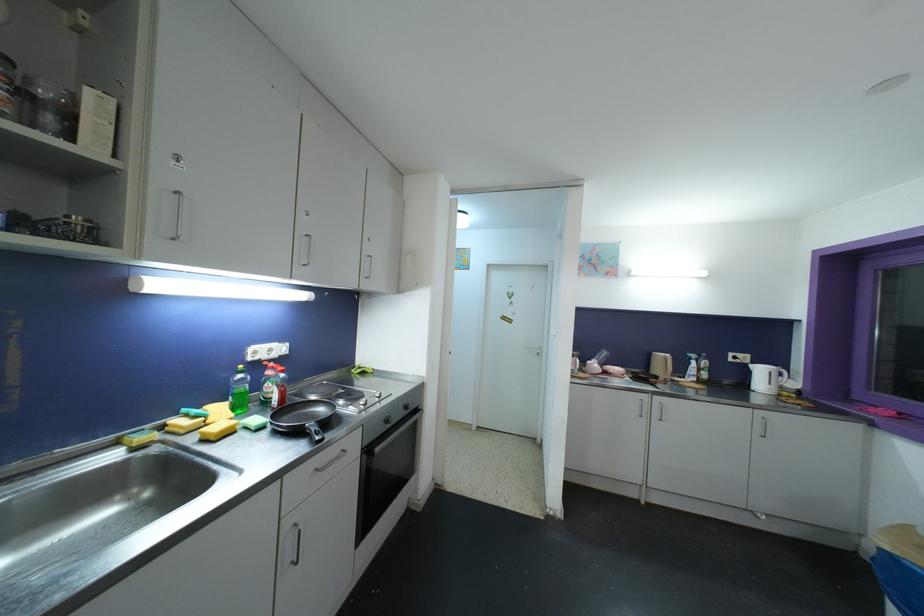
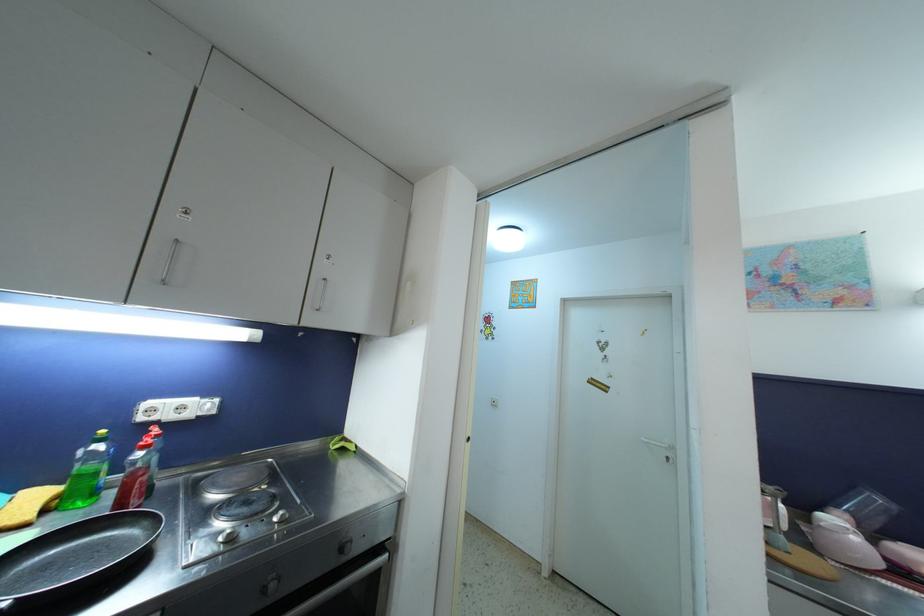
Question: The images are taken continuously from a first-person perspective. In which direction is your viewpoint rotating?

Choices:
 (A) Left
 (B) Right
 (C) Up
 (D) Down

Answer: (A)